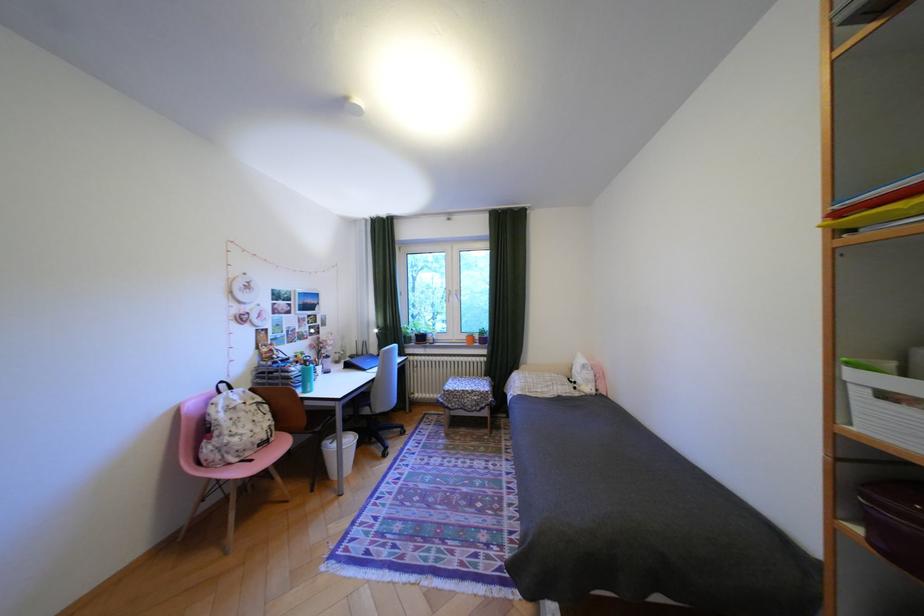
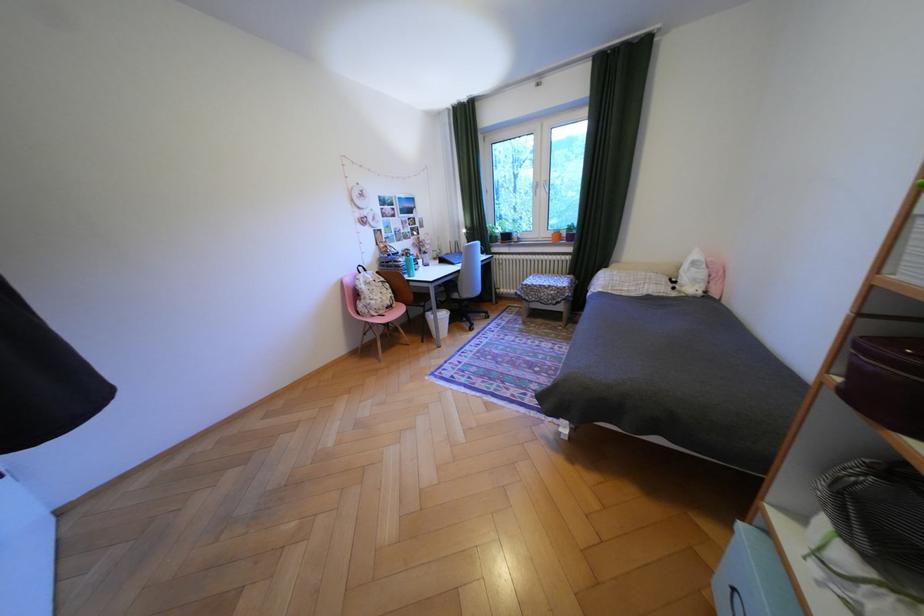
The point at (254, 415) is marked in the first image. Where is the corresponding point in the second image?

(386, 288)